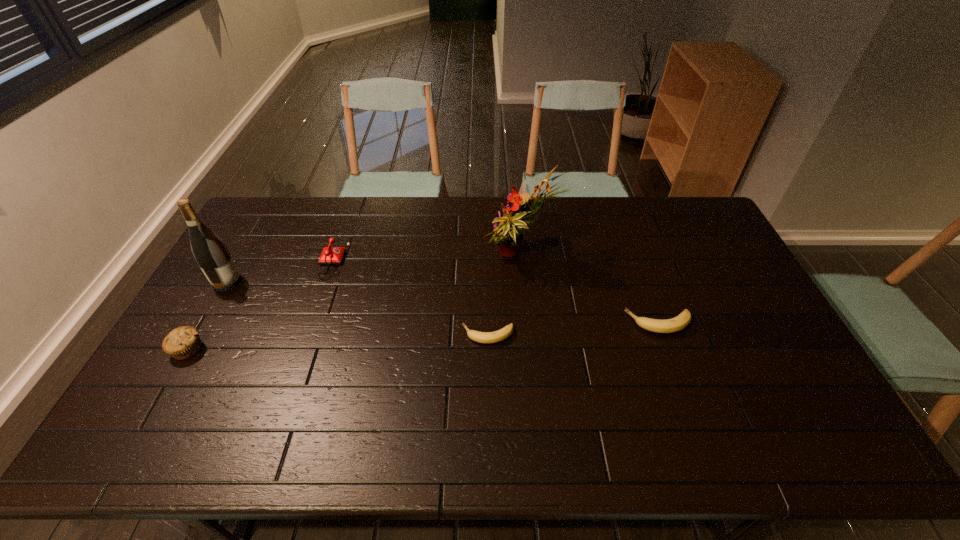
Where is `vacant area that lies between the wine bottle and the shortest object`? The width and height of the screenshot is (960, 540). vacant area that lies between the wine bottle and the shortest object is located at coordinates tap(357, 308).

You are a GUI agent. You are given a task and a screenshot of the screen. Output one action in this format:
    pyautogui.click(x=<x>, y=<y>)
    Task: Click on the free space between the wine bottle and the bouquet
    
    Given the screenshot: What is the action you would take?
    pyautogui.click(x=373, y=269)

You are a GUI agent. You are given a task and a screenshot of the screen. Output one action in this format:
    pyautogui.click(x=<x>, y=<y>)
    Task: Click on the blank region between the shorter banana and the third tallest object
    The width and height of the screenshot is (960, 540).
    Given the screenshot: What is the action you would take?
    pyautogui.click(x=338, y=342)

In order to click on blank region between the taller banana and the telephone in this screenshot , I will do `click(492, 291)`.

Find the location of a particular element. vacant area between the right banana and the telephone is located at coordinates tap(492, 291).

Identify the location of empty space that is in between the right banana and the shorter banana. (573, 329).

Where is `free spot between the shorter banana and the fourth shortest object`? This screenshot has height=540, width=960. free spot between the shorter banana and the fourth shortest object is located at coordinates (338, 342).

Identify the location of vacant space in between the bouquet and the fifth tallest object. (589, 290).

Locate an element on the screen. This screenshot has width=960, height=540. free space between the muffin and the bouquet is located at coordinates (354, 303).

The image size is (960, 540). What are the coordinates of `object that is the fourth closest to the fourth tallest object` in the screenshot? It's located at (508, 229).